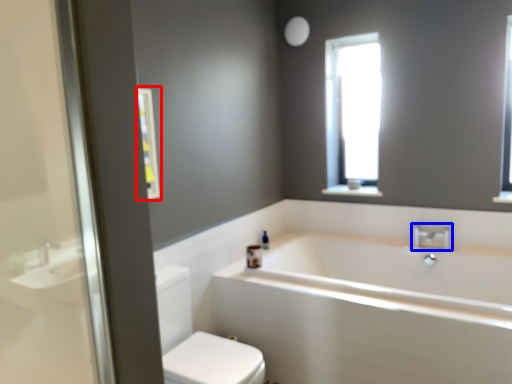
Question: Among these objects, which one is farthest to the camera, medicine cabinet (highlighted by a red box) or tap (highlighted by a blue box)?

Choices:
 (A) medicine cabinet
 (B) tap

Answer: (B)